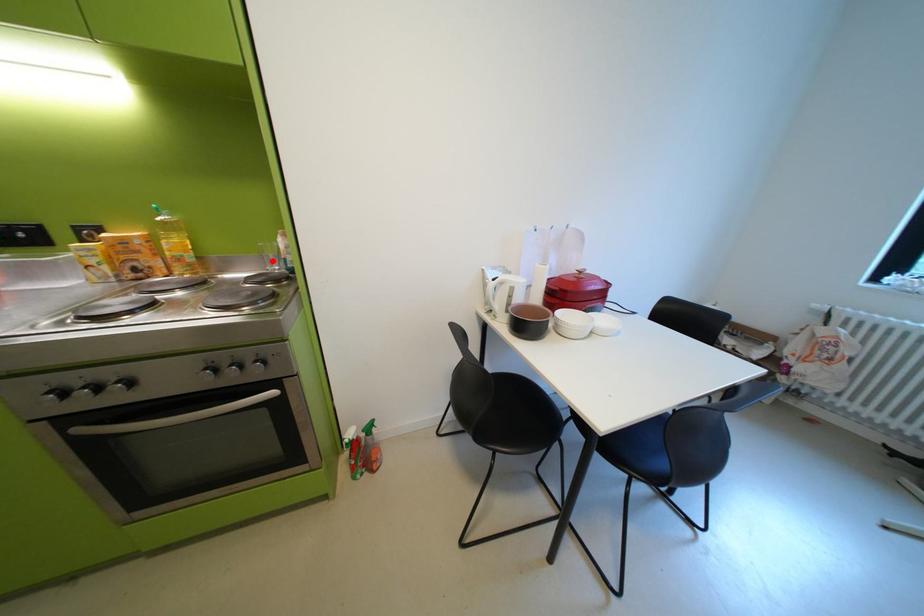
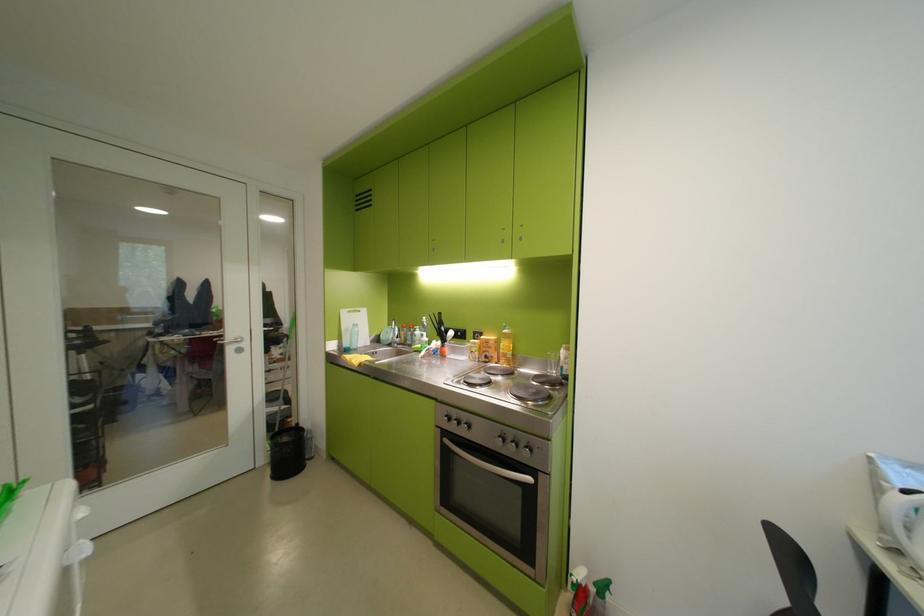
In the second image, find the point that corresponds to the highlighted location in the first image.

(556, 363)